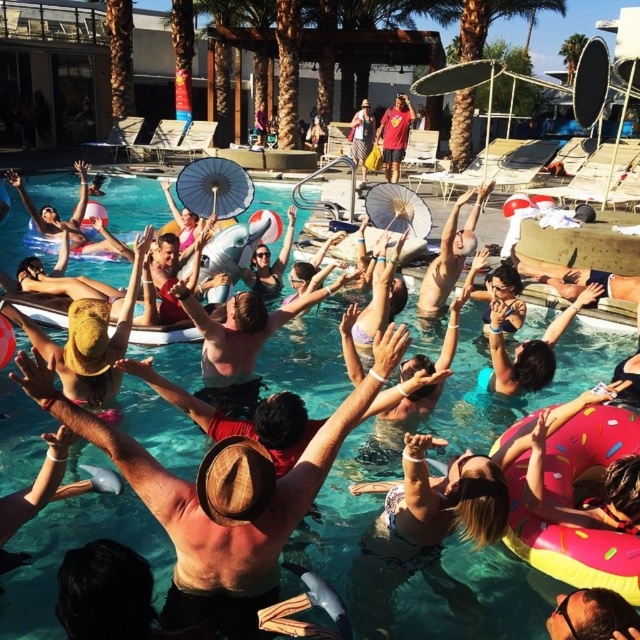
Looking at this image, you are a photographer at the pool party and want to capture a photo of the clear blue water at center and the smooth skin man at center. Since you can only focus on one subject, which one should you choose if you want to focus on the one closer to the camera?

The clear blue water at center is to the left of smooth skin man at center, so the photographer should focus on the clear blue water at center because it is closer to the camera.